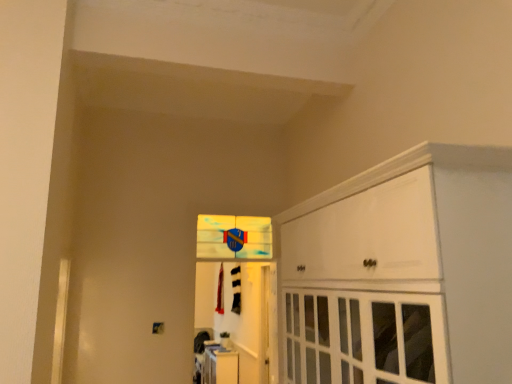
What are the coordinates of `white glossy door at center` in the screenshot? It's located at (237, 299).

What do you see at coordinates (220, 366) in the screenshot? I see `white glossy cabinet at lower center, placed as the 2th cabinetry when sorted from front to back` at bounding box center [220, 366].

What are the coordinates of `white glossy door at center` in the screenshot? It's located at (237, 299).

From a real-world perspective, between white glossy cabinet at upper right, which appears as the 1th cabinetry when viewed from the top, and translucent glass window at center, who is vertically lower?

In real-world perspective, white glossy cabinet at upper right, which appears as the 1th cabinetry when viewed from the top, is lower.

Is white glossy cabinet at upper right, which is counted as the second cabinetry, starting from the back, bigger or smaller than translucent glass window at center?

In the image, white glossy cabinet at upper right, which is counted as the second cabinetry, starting from the back, appears to be larger than translucent glass window at center.

Does white glossy cabinet at upper right, which is the second cabinetry from left to right, have a lesser width compared to translucent glass window at center?

No, white glossy cabinet at upper right, which is the second cabinetry from left to right, is not thinner than translucent glass window at center.

Which object is closer to the camera, white glossy cabinet at upper right, which appears as the 1th cabinetry when viewed from the top, or translucent glass window at center?

white glossy cabinet at upper right, which appears as the 1th cabinetry when viewed from the top, is in front.

Is white glossy cabinet at upper right, which appears as the 1th cabinetry when viewed from the top, positioned beyond the bounds of white glossy cabinet at lower center, positioned as the first cabinetry in back-to-front order?

Yes, white glossy cabinet at upper right, which appears as the 1th cabinetry when viewed from the top, is outside of white glossy cabinet at lower center, positioned as the first cabinetry in back-to-front order.

Who is bigger, white glossy cabinet at upper right, marked as the 1th cabinetry in a front-to-back arrangement, or white glossy cabinet at lower center, which is counted as the 2th cabinetry, starting from the top?

white glossy cabinet at upper right, marked as the 1th cabinetry in a front-to-back arrangement.

You are a GUI agent. You are given a task and a screenshot of the screen. Output one action in this format:
    pyautogui.click(x=<x>, y=<y>)
    Task: Click on the cabinetry above the white glossy cabinet at lower center, placed as the 2th cabinetry when sorted from front to back (from a real-world perspective)
    The height and width of the screenshot is (384, 512).
    Given the screenshot: What is the action you would take?
    pyautogui.click(x=402, y=272)

Does white glossy cabinet at upper right, marked as the 1th cabinetry in a front-to-back arrangement, have a lesser width compared to white glossy cabinet at lower center, placed as the 2th cabinetry when sorted from front to back?

No, white glossy cabinet at upper right, marked as the 1th cabinetry in a front-to-back arrangement, is not thinner than white glossy cabinet at lower center, placed as the 2th cabinetry when sorted from front to back.

Based on the photo, considering the relative sizes of white glossy cabinet at lower center, positioned as the first cabinetry in back-to-front order, and white glossy cabinet at upper right, placed as the second cabinetry when sorted from bottom to top, in the image provided, is white glossy cabinet at lower center, positioned as the first cabinetry in back-to-front order, smaller than white glossy cabinet at upper right, placed as the second cabinetry when sorted from bottom to top,?

Indeed, white glossy cabinet at lower center, positioned as the first cabinetry in back-to-front order, has a smaller size compared to white glossy cabinet at upper right, placed as the second cabinetry when sorted from bottom to top.

From the image's perspective, which object appears higher, white glossy cabinet at lower center, which ranks as the second cabinetry in right-to-left order, or white glossy cabinet at upper right, which is counted as the second cabinetry, starting from the back?

white glossy cabinet at upper right, which is counted as the second cabinetry, starting from the back, from the image's perspective.

Image resolution: width=512 pixels, height=384 pixels. Identify the location of cabinetry below the white glossy cabinet at upper right, which appears as the 1th cabinetry when viewed from the top (from the image's perspective). (220, 366).

How far apart are translucent glass window at center and white glossy door at center?

translucent glass window at center is 5.68 feet from white glossy door at center.

From a real-world perspective, is translucent glass window at center on top of white glossy door at center?

Yes, from a real-world perspective, translucent glass window at center is above white glossy door at center.

Is translucent glass window at center situated inside white glossy door at center or outside?

translucent glass window at center is located beyond the bounds of white glossy door at center.

Is translucent glass window at center far away from white glossy door at center?

Absolutely, translucent glass window at center is distant from white glossy door at center.

Which object is wider, white glossy cabinet at lower center, placed as the 2th cabinetry when sorted from front to back, or white glossy door at center?

Wider between the two is white glossy cabinet at lower center, placed as the 2th cabinetry when sorted from front to back.

Is white glossy cabinet at lower center, which ranks as the second cabinetry in right-to-left order, at the right side of white glossy door at center?

In fact, white glossy cabinet at lower center, which ranks as the second cabinetry in right-to-left order, is to the left of white glossy door at center.

Is white glossy cabinet at lower center, positioned as the first cabinetry in back-to-front order, not within white glossy door at center?

white glossy cabinet at lower center, positioned as the first cabinetry in back-to-front order, lies outside white glossy door at center's area.

From the picture: From a real-world perspective, is white glossy door at center physically located above or below white glossy cabinet at lower center, the first cabinetry from the left?

Clearly, from a real-world perspective, white glossy door at center is above white glossy cabinet at lower center, the first cabinetry from the left.

Who is bigger, white glossy door at center or white glossy cabinet at lower center, which appears as the first cabinetry when ordered from the bottom?

With larger size is white glossy cabinet at lower center, which appears as the first cabinetry when ordered from the bottom.

Considering the positions of objects white glossy door at center and white glossy cabinet at lower center, which is counted as the 2th cabinetry, starting from the top, in the image provided, who is in front, white glossy door at center or white glossy cabinet at lower center, which is counted as the 2th cabinetry, starting from the top,?

white glossy door at center.

Is white glossy door at center far from white glossy cabinet at lower center, positioned as the first cabinetry in back-to-front order?

white glossy door at center is actually quite close to white glossy cabinet at lower center, positioned as the first cabinetry in back-to-front order.

Measure the distance between translucent glass window at center and white glossy cabinet at lower center, which appears as the first cabinetry when ordered from the bottom.

2.59 meters.

The height and width of the screenshot is (384, 512). I want to click on window lying in front of the white glossy cabinet at lower center, positioned as the first cabinetry in back-to-front order, so click(x=234, y=237).

Considering the relative sizes of translucent glass window at center and white glossy cabinet at lower center, placed as the 2th cabinetry when sorted from front to back, in the image provided, is translucent glass window at center shorter than white glossy cabinet at lower center, placed as the 2th cabinetry when sorted from front to back,?

Indeed, translucent glass window at center has a lesser height compared to white glossy cabinet at lower center, placed as the 2th cabinetry when sorted from front to back.

What are the coordinates of `window behind the white glossy cabinet at upper right, which is the second cabinetry from left to right` in the screenshot? It's located at (234, 237).

Find the location of `cabinetry above the white glossy cabinet at lower center, the first cabinetry from the left (from a real-world perspective)`. cabinetry above the white glossy cabinet at lower center, the first cabinetry from the left (from a real-world perspective) is located at coordinates (402, 272).

Based on their spatial positions, is white glossy door at center or white glossy cabinet at lower center, the first cabinetry from the left, closer to white glossy cabinet at upper right, which is the second cabinetry from left to right?

white glossy door at center lies closer to white glossy cabinet at upper right, which is the second cabinetry from left to right, than the other object.

Looking at the image, which one is located closer to white glossy cabinet at lower center, which appears as the first cabinetry when ordered from the bottom, translucent glass window at center or white glossy door at center?

white glossy door at center lies closer to white glossy cabinet at lower center, which appears as the first cabinetry when ordered from the bottom, than the other object.

When comparing their distances from translucent glass window at center, does white glossy cabinet at upper right, which is counted as the second cabinetry, starting from the back, or white glossy cabinet at lower center, which is counted as the 2th cabinetry, starting from the top, seem closer?

white glossy cabinet at upper right, which is counted as the second cabinetry, starting from the back, is positioned closer to the anchor translucent glass window at center.

Considering their positions, is translucent glass window at center positioned closer to white glossy cabinet at lower center, which ranks as the second cabinetry in right-to-left order, than white glossy cabinet at upper right, marked as the 1th cabinetry in a front-to-back arrangement?

translucent glass window at center is closer to white glossy cabinet at lower center, which ranks as the second cabinetry in right-to-left order.

Estimate the real-world distances between objects in this image. Which object is further from white glossy door at center, translucent glass window at center or white glossy cabinet at lower center, positioned as the first cabinetry in back-to-front order?

translucent glass window at center is further to white glossy door at center.

Estimate the real-world distances between objects in this image. Which object is closer to white glossy door at center, white glossy cabinet at upper right, which is the 1th cabinetry in right-to-left order, or white glossy cabinet at lower center, placed as the 2th cabinetry when sorted from front to back?

Among the two, white glossy cabinet at lower center, placed as the 2th cabinetry when sorted from front to back, is located nearer to white glossy door at center.

In the scene shown: Considering their positions, is white glossy door at center positioned closer to white glossy cabinet at lower center, which ranks as the second cabinetry in right-to-left order, than translucent glass window at center?

white glossy door at center is positioned closer to the anchor white glossy cabinet at lower center, which ranks as the second cabinetry in right-to-left order.

When comparing their distances from white glossy door at center, does white glossy cabinet at upper right, marked as the 1th cabinetry in a front-to-back arrangement, or translucent glass window at center seem further?

The object further to white glossy door at center is white glossy cabinet at upper right, marked as the 1th cabinetry in a front-to-back arrangement.

This screenshot has width=512, height=384. In order to click on window between white glossy cabinet at upper right, which appears as the 1th cabinetry when viewed from the top, and white glossy cabinet at lower center, the first cabinetry from the left, from front to back in this screenshot , I will do `click(234, 237)`.

What are the coordinates of `door between translucent glass window at center and white glossy cabinet at lower center, which is counted as the 2th cabinetry, starting from the top, vertically` in the screenshot? It's located at (237, 299).

You are a GUI agent. You are given a task and a screenshot of the screen. Output one action in this format:
    pyautogui.click(x=<x>, y=<y>)
    Task: Click on the door between white glossy cabinet at upper right, which appears as the 1th cabinetry when viewed from the top, and translucent glass window at center in the front-back direction
    This screenshot has width=512, height=384.
    Given the screenshot: What is the action you would take?
    pyautogui.click(x=237, y=299)

You are a GUI agent. You are given a task and a screenshot of the screen. Output one action in this format:
    pyautogui.click(x=<x>, y=<y>)
    Task: Click on the door between white glossy cabinet at upper right, which is counted as the second cabinetry, starting from the back, and white glossy cabinet at lower center, which ranks as the second cabinetry in right-to-left order, from front to back
    The image size is (512, 384).
    Given the screenshot: What is the action you would take?
    pyautogui.click(x=237, y=299)